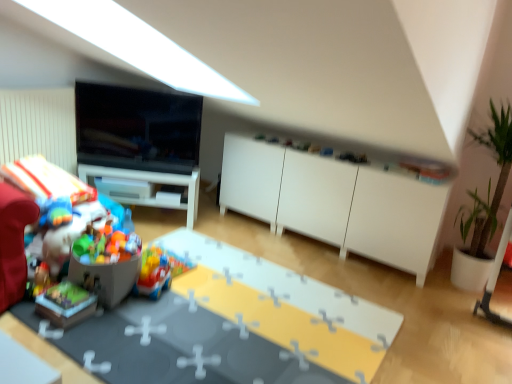
The image size is (512, 384). Identify the location of vacant point to the right of translucent plastic toy car at center, marked as the 4th toy in a left-to-right arrangement. (183, 287).